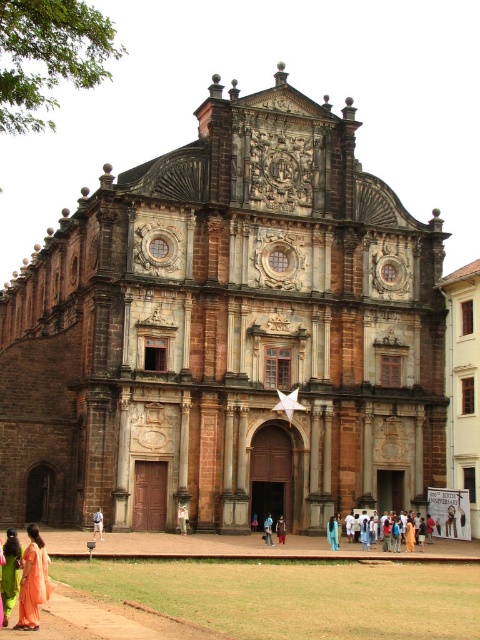
Can you confirm if brown stone church at center is shorter than light beige fabric pants at center?

No, brown stone church at center is not shorter than light beige fabric pants at center.

Which of these two, brown stone church at center or light beige fabric pants at center, stands shorter?

With less height is light beige fabric pants at center.

This screenshot has height=640, width=480. Find the location of `brown stone church at center`. brown stone church at center is located at coordinates (227, 333).

Is orange silk saree at lower left to the left of light beige fabric pants at center from the viewer's perspective?

Yes, orange silk saree at lower left is to the left of light beige fabric pants at center.

Is orange silk saree at lower left above light beige fabric pants at center?

No, orange silk saree at lower left is not above light beige fabric pants at center.

Where is `orange silk saree at lower left`? The width and height of the screenshot is (480, 640). orange silk saree at lower left is located at coordinates (33, 580).

Which is below, orange silk saree at lower left or light brown wooden stick at center?

Positioned lower is orange silk saree at lower left.

In the scene shown: Can you confirm if orange silk saree at lower left is bigger than light brown wooden stick at center?

Indeed, orange silk saree at lower left has a larger size compared to light brown wooden stick at center.

Is point (31, 609) positioned behind point (97, 518)?

That is False.

In order to click on orange silk saree at lower left in this screenshot , I will do `click(33, 580)`.